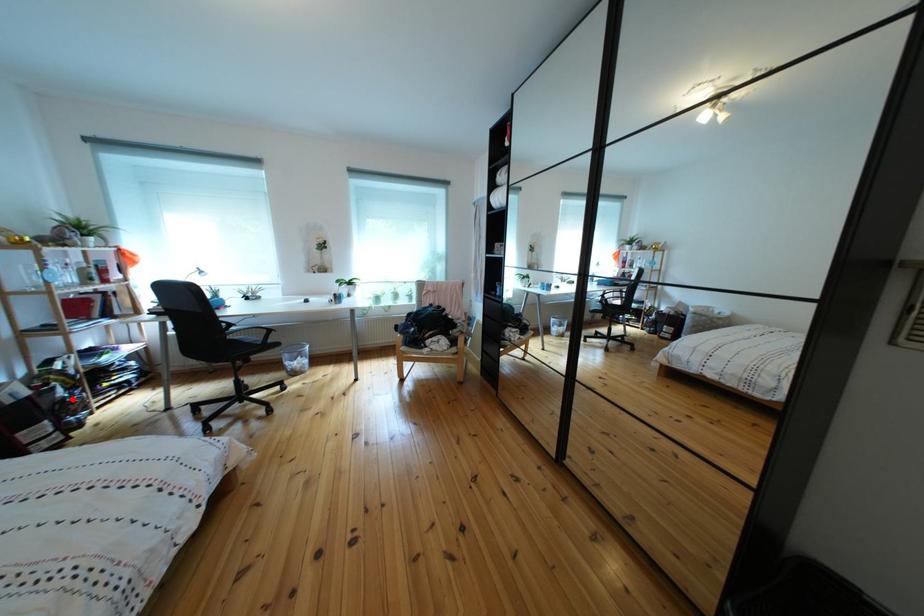
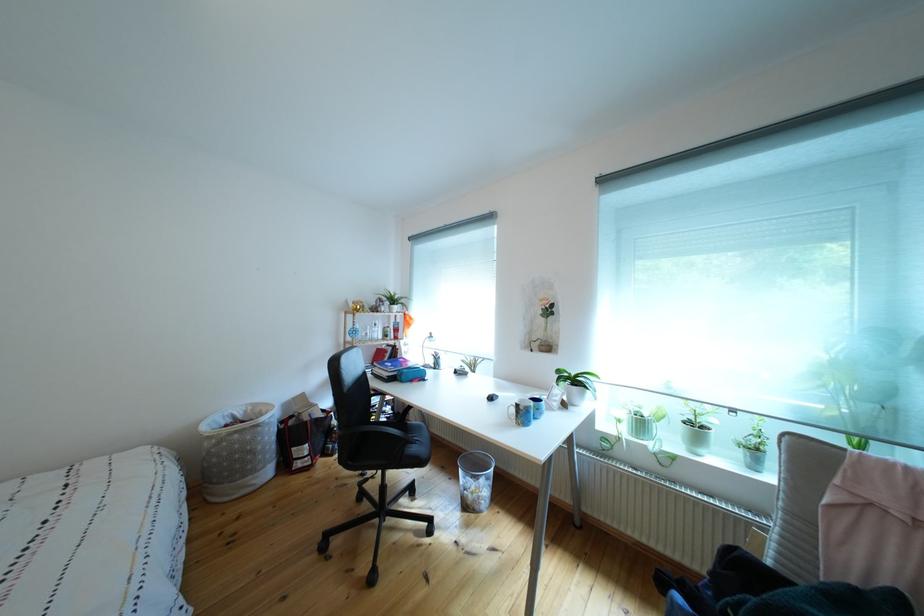
The point at the highlighted location is marked in the first image. Where is the corresponding point in the second image?

(346, 428)